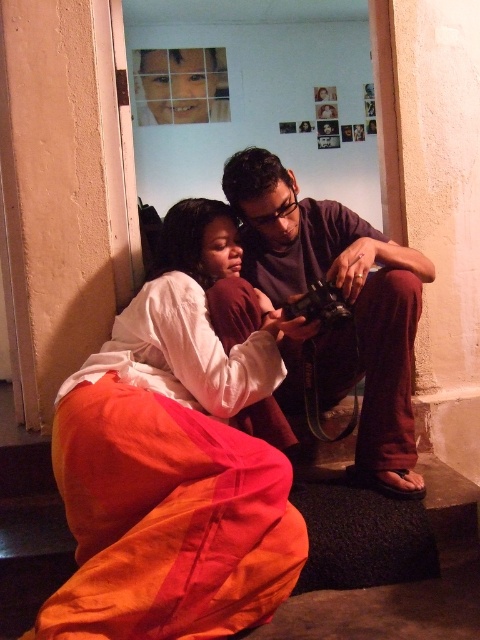
You are standing in the room where the two people are looking at a camera. You need to find the orange cotton pants at lower left. Where exactly should you look?

The orange cotton pants at lower left are located at point [173,461].

You are standing in the room where the two people are sitting. You want to hand a gift to the person wearing the orange cotton pants at lower left without disturbing the person in the dark purple shirt at center. Which direction should you approach from?

Since the orange cotton pants at lower left is closer to the viewer than the dark purple shirt at center, you should approach from the front to hand the gift to the orange cotton pants at lower left without obstructing the dark purple shirt at center.

Based on the photo, you are a photographer trying to capture a candid shot of two people discussing a photo on a camera. You notice the orange cotton pants at lower left and the dark purple shirt at center in your viewfinder. Based on their positions, which clothing item is closer to the left edge of the frame?

The orange cotton pants at lower left is to the left of dark purple shirt at center, so the orange cotton pants at lower left is closer to the left edge of the frame.